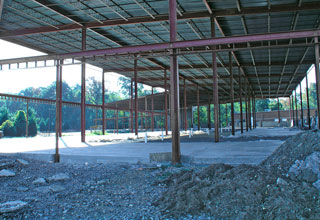
The height and width of the screenshot is (220, 320). What are the coordinates of `ceiling` in the screenshot? It's located at (262, 60).